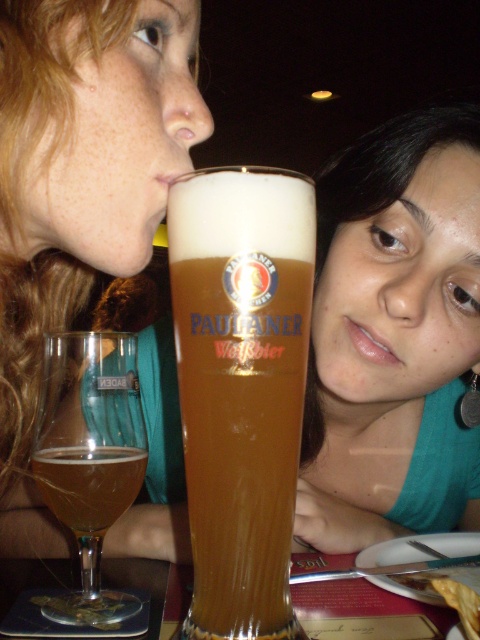
You are a photographer setting up for a portrait. You notice the matte black hair at upper left and the translucent glass coaster at lower left in your frame. Which object should you focus on if you want to capture the subject that is closer to the camera?

The translucent glass coaster at lower left is closer to the camera than the matte black hair at upper left because it is much shorter in height.

You are at a table with two points marked on it. The first point is at coordinate point (271, 296) and the second is at coordinate point (96, 486). If you were to draw a straight line from the first point to the second point, would the line pass through the glass of Paulaner Weissbier beer?

The line from point (271, 296) to point (96, 486) would pass through the glass of Paulaner Weissbier beer because the first point is in front of the second point, indicating the glass is between them.